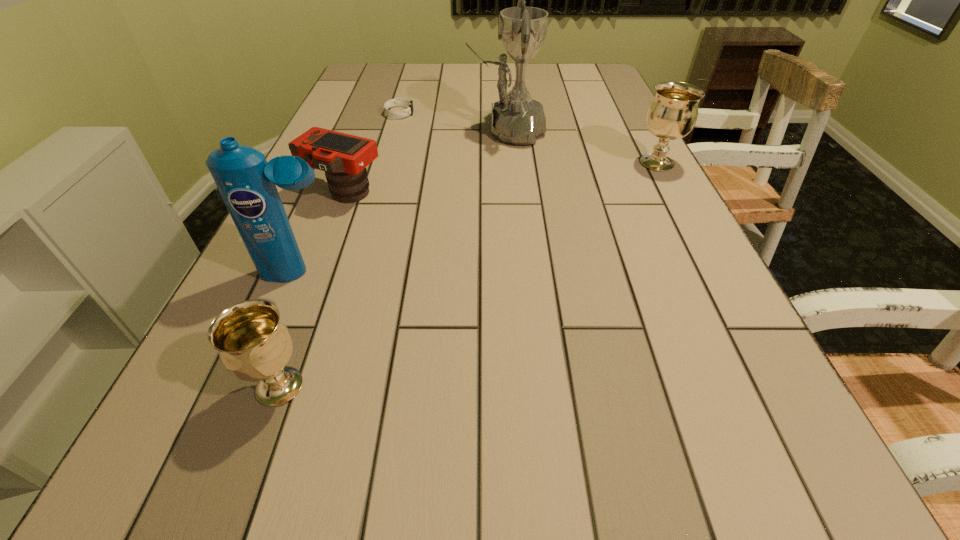
Where is `vacant area that lies between the shorter chalice and the shortest object`? The image size is (960, 540). vacant area that lies between the shorter chalice and the shortest object is located at coordinates (340, 250).

Where is `free space between the camera and the award`? The height and width of the screenshot is (540, 960). free space between the camera and the award is located at coordinates (425, 161).

The image size is (960, 540). I want to click on free space between the nearest object and the fourth shortest object, so click(468, 275).

Locate an element on the screen. The width and height of the screenshot is (960, 540). empty location between the nearest object and the fifth object from left to right is located at coordinates (393, 259).

You are a GUI agent. You are given a task and a screenshot of the screen. Output one action in this format:
    pyautogui.click(x=<x>, y=<y>)
    Task: Click on the object that is the third nearest to the shortest object
    
    Given the screenshot: What is the action you would take?
    pyautogui.click(x=247, y=183)

Find the location of `object that stands as the third closest to the fifth shortest object`. object that stands as the third closest to the fifth shortest object is located at coordinates (517, 119).

At what (x,y) coordinates should I click in order to perform the action: click on vacant area that satisfies the following two spatial constraints: 1. on the side with emblem of the rightmost object; 2. on the left side of the fifth object from left to right. Please return your answer as a coordinate pair (x, y). This screenshot has width=960, height=540. Looking at the image, I should click on (509, 163).

Where is `free space that satisfies the following two spatial constraints: 1. on the front side of the fifth shortest object; 2. on the right side of the shorter chalice`? The height and width of the screenshot is (540, 960). free space that satisfies the following two spatial constraints: 1. on the front side of the fifth shortest object; 2. on the right side of the shorter chalice is located at coordinates (255, 387).

Identify the location of vacant space that satisfies the following two spatial constraints: 1. on the back side of the right chalice; 2. on the outer surface of the wristband. (630, 113).

I want to click on free space that satisfies the following two spatial constraints: 1. on the side with emblem of the award; 2. on the front side of the shampoo, so click(x=518, y=273).